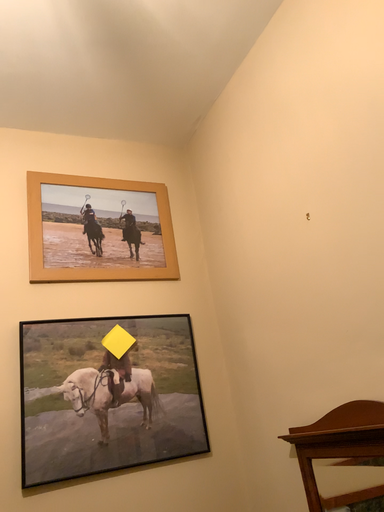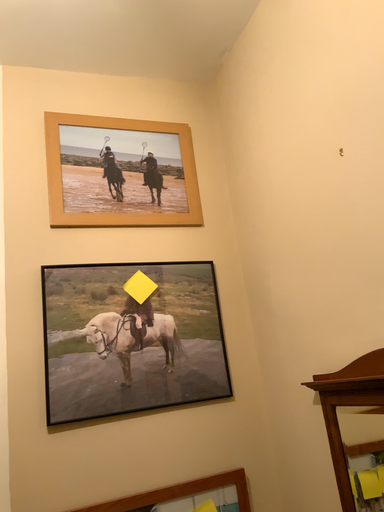
Question: Which way did the camera rotate in the video?

Choices:
 (A) rotated upward
 (B) rotated downward

Answer: (B)